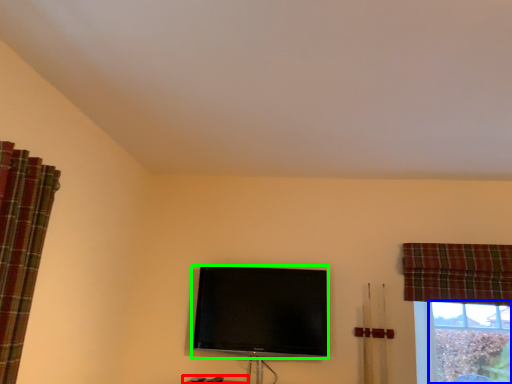
Question: Considering the real-world distances, which object is closest to furniture (highlighted by a red box)? bay window (highlighted by a blue box) or television (highlighted by a green box).

Choices:
 (A) bay window
 (B) television

Answer: (B)